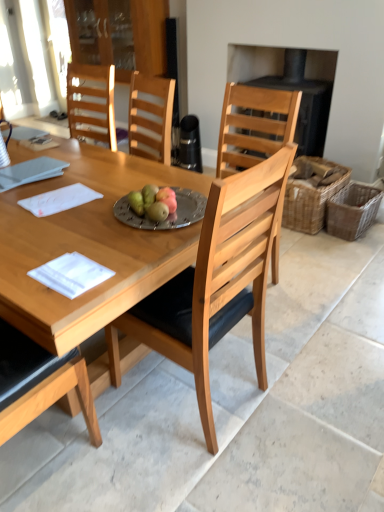
I want to click on blank space situated above white paper at center, the 1th notepad when ordered from bottom to top (from a real-world perspective), so click(71, 269).